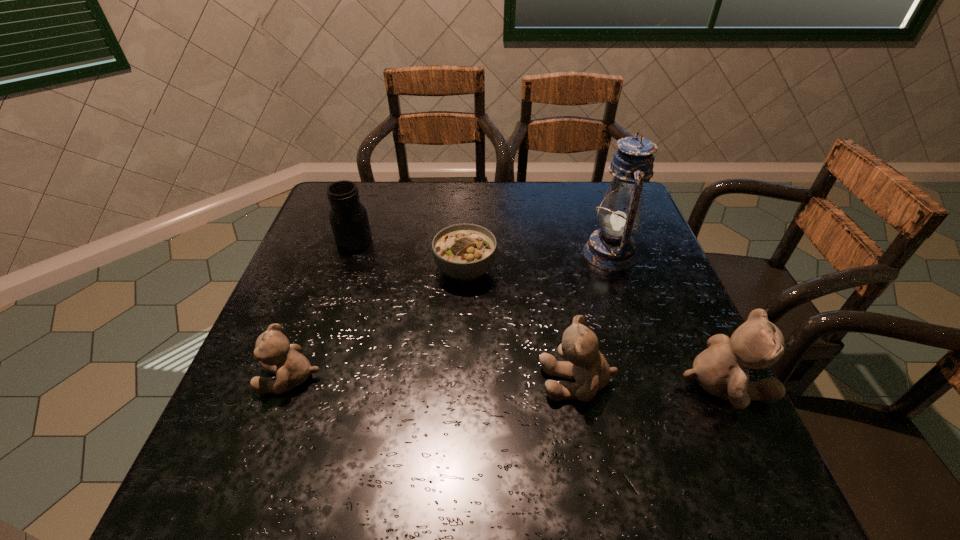
Where is `free spot between the shortest object and the rightmost teddy bear`? The height and width of the screenshot is (540, 960). free spot between the shortest object and the rightmost teddy bear is located at coordinates (593, 326).

Where is `empty location between the jar and the rightmost teddy bear`? This screenshot has width=960, height=540. empty location between the jar and the rightmost teddy bear is located at coordinates (539, 312).

At what (x,y) coordinates should I click in order to perform the action: click on free space that is in between the jar and the second shortest object. Please return your answer as a coordinate pair (x, y). The height and width of the screenshot is (540, 960). Looking at the image, I should click on (323, 309).

Locate an element on the screen. vacant area that lies between the rightmost teddy bear and the second teddy bear from right to left is located at coordinates (650, 382).

Find the location of a particular element. The width and height of the screenshot is (960, 540). vacant space that is in between the second teddy bear from left to right and the jar is located at coordinates (466, 312).

Locate an element on the screen. This screenshot has height=540, width=960. vacant space that is in between the fourth object from left to right and the fifth tallest object is located at coordinates (434, 380).

You are a GUI agent. You are given a task and a screenshot of the screen. Output one action in this format:
    pyautogui.click(x=<x>, y=<y>)
    Task: Click on the blank region between the fifth tallest object and the fourth object from right to left
    The width and height of the screenshot is (960, 540).
    Given the screenshot: What is the action you would take?
    pyautogui.click(x=378, y=324)

Select which object is the closest to the fifth tallest object. Please provide its 2D coordinates. Your answer should be formatted as a tuple, i.e. [(x, y)], where the tuple contains the x and y coordinates of a point satisfying the conditions above.

[(462, 251)]

At what (x,y) coordinates should I click in order to perform the action: click on object that is the fifth nearest to the leftmost teddy bear. Please return your answer as a coordinate pair (x, y). Looking at the image, I should click on (722, 370).

Choose which teddy bear is the second nearest neighbor to the fourth object from right to left. Please provide its 2D coordinates. Your answer should be formatted as a tuple, i.e. [(x, y)], where the tuple contains the x and y coordinates of a point satisfying the conditions above.

[(275, 354)]